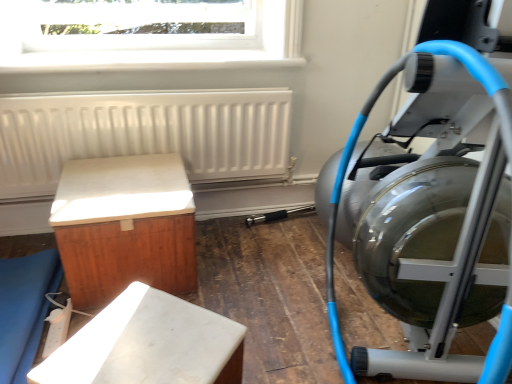
Looking at this image, measure the distance between transparent glass window at upper center and camera.

5.00 feet.

Image resolution: width=512 pixels, height=384 pixels. What do you see at coordinates (148, 344) in the screenshot? I see `white marble bench at lower center, acting as the 3th furniture starting from the left` at bounding box center [148, 344].

At what (x,y) coordinates should I click in order to perform the action: click on silver metallic stationary bicycle at right. Please return your answer as a coordinate pair (x, y). Looking at the image, I should click on (430, 217).

Consider the image. Considering the sizes of objects silver metallic stationary bicycle at right and transparent glass window at upper center in the image provided, who is bigger, silver metallic stationary bicycle at right or transparent glass window at upper center?

With larger size is silver metallic stationary bicycle at right.

Could you measure the distance between silver metallic stationary bicycle at right and transparent glass window at upper center?

35.88 inches.

Can you confirm if silver metallic stationary bicycle at right is taller than transparent glass window at upper center?

Yes, silver metallic stationary bicycle at right is taller than transparent glass window at upper center.

Looking at their sizes, would you say silver metallic stationary bicycle at right is wider or thinner than transparent glass window at upper center?

Considering their sizes, silver metallic stationary bicycle at right looks broader than transparent glass window at upper center.

Is white matte radiator at upper left outside of transparent glass window at upper center?

Yes, white matte radiator at upper left is not within transparent glass window at upper center.

Does point (53, 109) lie behind point (119, 54)?

No, it is in front of (119, 54).

Identify the location of window that appears behind the white matte radiator at upper left. (148, 34).

From the image's perspective, is transparent glass window at upper center beneath matte wood bench at lower left, which is the first furniture from left to right?

No, from the image's perspective, transparent glass window at upper center is not below matte wood bench at lower left, which is the first furniture from left to right.

In the image, is transparent glass window at upper center on the left side or the right side of matte wood bench at lower left, which is the first furniture from left to right?

In the image, transparent glass window at upper center appears on the right side of matte wood bench at lower left, which is the first furniture from left to right.

Is transparent glass window at upper center oriented away from matte wood bench at lower left, which is the first furniture from left to right?

No, transparent glass window at upper center is not facing away from matte wood bench at lower left, which is the first furniture from left to right.

Does transparent glass window at upper center lie behind matte wood bench at lower left, which is the first furniture from left to right?

Yes, it is behind matte wood bench at lower left, which is the first furniture from left to right.

Considering the positions of objects silver metallic stationary bicycle at right and white marble bench at lower center, the first furniture from the right, in the image provided, who is more to the right, silver metallic stationary bicycle at right or white marble bench at lower center, the first furniture from the right,?

silver metallic stationary bicycle at right.

Is silver metallic stationary bicycle at right aimed at white marble bench at lower center, acting as the 3th furniture starting from the left?

Yes, silver metallic stationary bicycle at right faces towards white marble bench at lower center, acting as the 3th furniture starting from the left.

Consider the image. Does silver metallic stationary bicycle at right have a larger size compared to white marble bench at lower center, the first furniture from the right?

Indeed, silver metallic stationary bicycle at right has a larger size compared to white marble bench at lower center, the first furniture from the right.

Can you confirm if silver metallic stationary bicycle at right is wider than white matte cabinet at left, marked as the 2th furniture in a left-to-right arrangement?

In fact, silver metallic stationary bicycle at right might be narrower than white matte cabinet at left, marked as the 2th furniture in a left-to-right arrangement.

From a real-world perspective, does silver metallic stationary bicycle at right sit lower than white matte cabinet at left, which ranks as the 2th furniture in right-to-left order?

Incorrect, from a real-world perspective, silver metallic stationary bicycle at right is higher than white matte cabinet at left, which ranks as the 2th furniture in right-to-left order.

Is silver metallic stationary bicycle at right positioned beyond the bounds of white matte cabinet at left, which ranks as the 2th furniture in right-to-left order?

silver metallic stationary bicycle at right is positioned outside white matte cabinet at left, which ranks as the 2th furniture in right-to-left order.

Which point is more forward, (x=331, y=264) or (x=102, y=252)?

The point (x=102, y=252) is closer.

In the scene shown: Is silver metallic stationary bicycle at right not near white matte radiator at upper left?

No, silver metallic stationary bicycle at right is not far from white matte radiator at upper left.

Is silver metallic stationary bicycle at right completely or partially outside of white matte radiator at upper left?

Yes.

In terms of size, does silver metallic stationary bicycle at right appear bigger or smaller than white matte radiator at upper left?

silver metallic stationary bicycle at right is bigger than white matte radiator at upper left.

Which is behind, silver metallic stationary bicycle at right or white matte radiator at upper left?

white matte radiator at upper left is behind.

Is transparent glass window at upper center spatially inside white matte radiator at upper left, or outside of it?

transparent glass window at upper center is not enclosed by white matte radiator at upper left.

Which is more to the left, transparent glass window at upper center or white matte radiator at upper left?

transparent glass window at upper center is more to the left.

Is point (170, 4) closer or farther from the camera than point (124, 113)?

Point (170, 4).

I want to click on window above the silver metallic stationary bicycle at right (from a real-world perspective), so click(148, 34).

Identify the location of radiator located underneath the transparent glass window at upper center (from a real-world perspective). (143, 134).

Considering their positions, is white marble bench at lower center, acting as the 3th furniture starting from the left, positioned closer to white matte radiator at upper left than silver metallic stationary bicycle at right?

Among the two, silver metallic stationary bicycle at right is located nearer to white matte radiator at upper left.

Which object lies nearer to the anchor point transparent glass window at upper center, matte wood bench at lower left, the 3th furniture when ordered from right to left, or silver metallic stationary bicycle at right?

Among the two, silver metallic stationary bicycle at right is located nearer to transparent glass window at upper center.

Based on their spatial positions, is silver metallic stationary bicycle at right or matte wood bench at lower left, the 3th furniture when ordered from right to left, further from white matte cabinet at left, marked as the 2th furniture in a left-to-right arrangement?

silver metallic stationary bicycle at right.

Which object lies nearer to the anchor point white matte cabinet at left, marked as the 2th furniture in a left-to-right arrangement, silver metallic stationary bicycle at right or white marble bench at lower center, the first furniture from the right?

white marble bench at lower center, the first furniture from the right.

Considering their positions, is white matte cabinet at left, which ranks as the 2th furniture in right-to-left order, positioned further to white matte radiator at upper left than transparent glass window at upper center?

white matte cabinet at left, which ranks as the 2th furniture in right-to-left order.

Based on their spatial positions, is matte wood bench at lower left, the 3th furniture when ordered from right to left, or transparent glass window at upper center closer to white matte cabinet at left, which ranks as the 2th furniture in right-to-left order?

matte wood bench at lower left, the 3th furniture when ordered from right to left, lies closer to white matte cabinet at left, which ranks as the 2th furniture in right-to-left order, than the other object.

Considering their positions, is white matte radiator at upper left positioned closer to matte wood bench at lower left, which is the first furniture from left to right, than silver metallic stationary bicycle at right?

Among the two, white matte radiator at upper left is located nearer to matte wood bench at lower left, which is the first furniture from left to right.

Considering their positions, is silver metallic stationary bicycle at right positioned further to transparent glass window at upper center than white matte cabinet at left, which ranks as the 2th furniture in right-to-left order?

silver metallic stationary bicycle at right is positioned further to the anchor transparent glass window at upper center.

Where is `stationary bicycle between transparent glass window at upper center and white marble bench at lower center, acting as the 3th furniture starting from the left, from top to bottom`? This screenshot has height=384, width=512. stationary bicycle between transparent glass window at upper center and white marble bench at lower center, acting as the 3th furniture starting from the left, from top to bottom is located at coordinates (430, 217).

Find the location of a particular element. This screenshot has width=512, height=384. furniture between white matte cabinet at left, which ranks as the 2th furniture in right-to-left order, and silver metallic stationary bicycle at right from left to right is located at coordinates (148, 344).

Find the location of `radiator between silver metallic stationary bicycle at right and transparent glass window at upper center from front to back`. radiator between silver metallic stationary bicycle at right and transparent glass window at upper center from front to back is located at coordinates (143, 134).

Locate an element on the screen. The height and width of the screenshot is (384, 512). furniture between white matte radiator at upper left and matte wood bench at lower left, which is the first furniture from left to right, vertically is located at coordinates (124, 226).